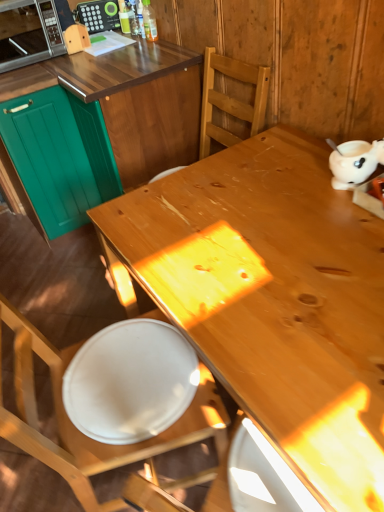
What are the coordinates of `translucent plastic bottle at upper center` in the screenshot? It's located at (149, 21).

Describe the element at coordinates (28, 33) in the screenshot. I see `metallic silver microwave at upper left` at that location.

Find the location of a particular element. The width and height of the screenshot is (384, 512). teal matte cabinet at left, the second cabinetry viewed from the right is located at coordinates (60, 156).

Describe the element at coordinates (99, 126) in the screenshot. The height and width of the screenshot is (512, 384). I see `teal wood cabinetry at left, arranged as the 1th cabinetry when viewed from the right` at that location.

Identify the location of translucent plastic bottle at upper center. (149, 21).

Does wooden chair at center have a greater height compared to teal wood cabinetry at left, which is the 2th cabinetry in left-to-right order?

Yes, wooden chair at center is taller than teal wood cabinetry at left, which is the 2th cabinetry in left-to-right order.

Identify the location of chair that appears above the teal wood cabinetry at left, arranged as the 1th cabinetry when viewed from the right (from a real-world perspective). (83, 434).

From a real-world perspective, is wooden chair at center positioned above or below teal wood cabinetry at left, which is the 2th cabinetry in left-to-right order?

From a real-world perspective, wooden chair at center is physically above teal wood cabinetry at left, which is the 2th cabinetry in left-to-right order.

From the picture: From the image's perspective, which one is positioned lower, wooden chair at center or teal wood cabinetry at left, which is the 2th cabinetry in left-to-right order?

wooden chair at center, from the image's perspective.

How many degrees apart are the facing directions of metallic silver microwave at upper left and natural wood desk at center?

They differ by 90.2 degrees in their facing directions.

Looking at this image, between metallic silver microwave at upper left and natural wood desk at center, which one has less height?

metallic silver microwave at upper left.

Which is behind, metallic silver microwave at upper left or natural wood desk at center?

metallic silver microwave at upper left is behind.

From a real-world perspective, which object stands above the other?

metallic silver microwave at upper left, from a real-world perspective.

Is metallic silver microwave at upper left in contact with matte black radio at upper left?

There is a gap between metallic silver microwave at upper left and matte black radio at upper left.

How different are the orientations of metallic silver microwave at upper left and matte black radio at upper left in degrees?

23.2 degrees separate the facing orientations of metallic silver microwave at upper left and matte black radio at upper left.

Is metallic silver microwave at upper left to the left of matte black radio at upper left from the viewer's perspective?

Yes.

Does metallic silver microwave at upper left have a greater height compared to matte black radio at upper left?

Yes, metallic silver microwave at upper left is taller than matte black radio at upper left.

From the image's perspective, is teal wood cabinetry at left, which is the 2th cabinetry in left-to-right order, located above natural wood desk at center?

Yes.

Is teal wood cabinetry at left, arranged as the 1th cabinetry when viewed from the right, looking in the opposite direction of natural wood desk at center?

That's not correct — teal wood cabinetry at left, arranged as the 1th cabinetry when viewed from the right, is not looking away from natural wood desk at center.

From their relative heights in the image, would you say teal wood cabinetry at left, which is the 2th cabinetry in left-to-right order, is taller or shorter than natural wood desk at center?

Clearly, teal wood cabinetry at left, which is the 2th cabinetry in left-to-right order, is taller compared to natural wood desk at center.

In the scene shown: Considering the relative positions of teal wood cabinetry at left, arranged as the 1th cabinetry when viewed from the right, and natural wood desk at center in the image provided, is teal wood cabinetry at left, arranged as the 1th cabinetry when viewed from the right, behind natural wood desk at center?

Yes, teal wood cabinetry at left, arranged as the 1th cabinetry when viewed from the right, is further from the viewer.

Is translucent plastic bottle at upper center aimed at teal wood cabinetry at left, arranged as the 1th cabinetry when viewed from the right?

No, translucent plastic bottle at upper center is not facing towards teal wood cabinetry at left, arranged as the 1th cabinetry when viewed from the right.

From a real-world perspective, between translucent plastic bottle at upper center and teal wood cabinetry at left, which is the 2th cabinetry in left-to-right order, who is vertically higher?

translucent plastic bottle at upper center, from a real-world perspective.

Is teal wood cabinetry at left, arranged as the 1th cabinetry when viewed from the right, inside translucent plastic bottle at upper center?

No, teal wood cabinetry at left, arranged as the 1th cabinetry when viewed from the right, is not a part of translucent plastic bottle at upper center.

Can you confirm if translucent plastic bottle at upper center is positioned to the right of teal wood cabinetry at left, arranged as the 1th cabinetry when viewed from the right?

Correct, you'll find translucent plastic bottle at upper center to the right of teal wood cabinetry at left, arranged as the 1th cabinetry when viewed from the right.

Is natural wood desk at center bigger than teal wood cabinetry at left, which is the 2th cabinetry in left-to-right order?

Correct, natural wood desk at center is larger in size than teal wood cabinetry at left, which is the 2th cabinetry in left-to-right order.

How many degrees apart are the facing directions of natural wood desk at center and teal wood cabinetry at left, arranged as the 1th cabinetry when viewed from the right?

The angle between the facing direction of natural wood desk at center and the facing direction of teal wood cabinetry at left, arranged as the 1th cabinetry when viewed from the right, is 0.554 degrees.

Considering the sizes of natural wood desk at center and teal wood cabinetry at left, which is the 2th cabinetry in left-to-right order, in the image, is natural wood desk at center taller or shorter than teal wood cabinetry at left, which is the 2th cabinetry in left-to-right order,?

natural wood desk at center is shorter than teal wood cabinetry at left, which is the 2th cabinetry in left-to-right order.

Is natural wood desk at center far away from teal wood cabinetry at left, which is the 2th cabinetry in left-to-right order?

No, natural wood desk at center is in close proximity to teal wood cabinetry at left, which is the 2th cabinetry in left-to-right order.

From the image's perspective, is teal wood cabinetry at left, arranged as the 1th cabinetry when viewed from the right, under metallic silver microwave at upper left?

Correct, teal wood cabinetry at left, arranged as the 1th cabinetry when viewed from the right, appears lower than metallic silver microwave at upper left in the image.

Considering the sizes of objects teal wood cabinetry at left, arranged as the 1th cabinetry when viewed from the right, and metallic silver microwave at upper left in the image provided, who is bigger, teal wood cabinetry at left, arranged as the 1th cabinetry when viewed from the right, or metallic silver microwave at upper left?

teal wood cabinetry at left, arranged as the 1th cabinetry when viewed from the right.

In the scene shown: Is teal wood cabinetry at left, which is the 2th cabinetry in left-to-right order, closer to camera compared to metallic silver microwave at upper left?

Yes, it is.

Locate an element on the screen. This screenshot has height=512, width=384. chair below the teal wood cabinetry at left, which is the 2th cabinetry in left-to-right order (from the image's perspective) is located at coordinates (83, 434).

Find the location of a particular element. The image size is (384, 512). microwave oven above the natural wood desk at center (from a real-world perspective) is located at coordinates (28, 33).

From the image, which object appears to be nearer to natural wood desk at center, matte black radio at upper left or translucent plastic bottle at upper center?

translucent plastic bottle at upper center is closer to natural wood desk at center.

When comparing their distances from translucent plastic bottle at upper center, does teal matte cabinet at left, the first cabinetry positioned from the left, or wooden chair at center seem further?

wooden chair at center is further to translucent plastic bottle at upper center.

Estimate the real-world distances between objects in this image. Which object is closer to teal wood cabinetry at left, which is the 2th cabinetry in left-to-right order, teal matte cabinet at left, the first cabinetry positioned from the left, or natural wood desk at center?

teal matte cabinet at left, the first cabinetry positioned from the left.

From the picture: From the image, which object appears to be nearer to natural wood desk at center, matte black radio at upper left or white glossy plate at lower left?

Among the two, white glossy plate at lower left is located nearer to natural wood desk at center.

Consider the image. Looking at the image, which one is located further to natural wood desk at center, metallic silver microwave at upper left or teal matte cabinet at left, the second cabinetry viewed from the right?

metallic silver microwave at upper left is positioned further to the anchor natural wood desk at center.

In the scene shown: Which object lies nearer to the anchor point teal matte cabinet at left, the first cabinetry positioned from the left, white glossy plate at lower left or metallic silver microwave at upper left?

metallic silver microwave at upper left.

From the image, which object appears to be farther from teal matte cabinet at left, the second cabinetry viewed from the right, translucent plastic bottle at upper center or natural wood desk at center?

natural wood desk at center is positioned further to the anchor teal matte cabinet at left, the second cabinetry viewed from the right.

Estimate the real-world distances between objects in this image. Which object is further from translucent plastic bottle at upper center, teal matte cabinet at left, the second cabinetry viewed from the right, or white glossy plate at lower left?

white glossy plate at lower left is positioned further to the anchor translucent plastic bottle at upper center.

Find the location of a particular element. desk that lies between matte black radio at upper left and white glossy plate at lower left from top to bottom is located at coordinates (281, 302).

The height and width of the screenshot is (512, 384). I want to click on cabinetry between translucent plastic bottle at upper center and teal matte cabinet at left, the first cabinetry positioned from the left, from top to bottom, so click(99, 126).

Where is `microwave oven that lies between translucent plastic bottle at upper center and natural wood desk at center from top to bottom`? microwave oven that lies between translucent plastic bottle at upper center and natural wood desk at center from top to bottom is located at coordinates (28, 33).

What are the coordinates of `desk between teal wood cabinetry at left, arranged as the 1th cabinetry when viewed from the right, and white glossy plate at lower left in the up-down direction` in the screenshot? It's located at (281, 302).